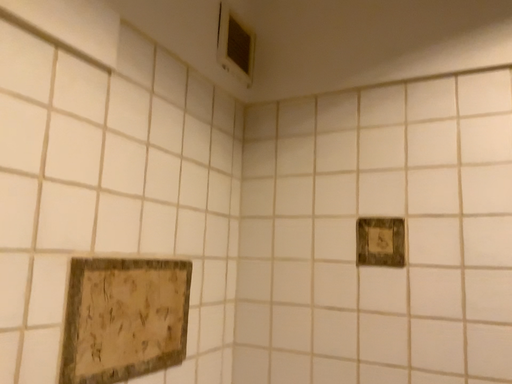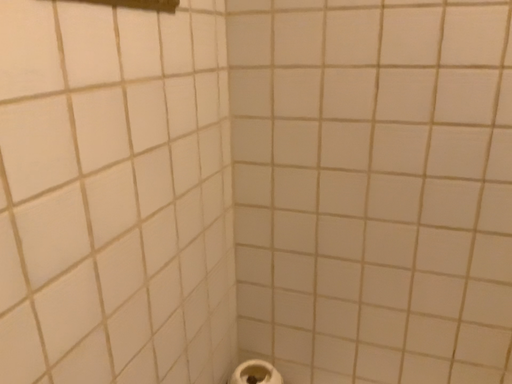
Question: Which way did the camera rotate in the video?

Choices:
 (A) rotated upward
 (B) rotated downward

Answer: (B)